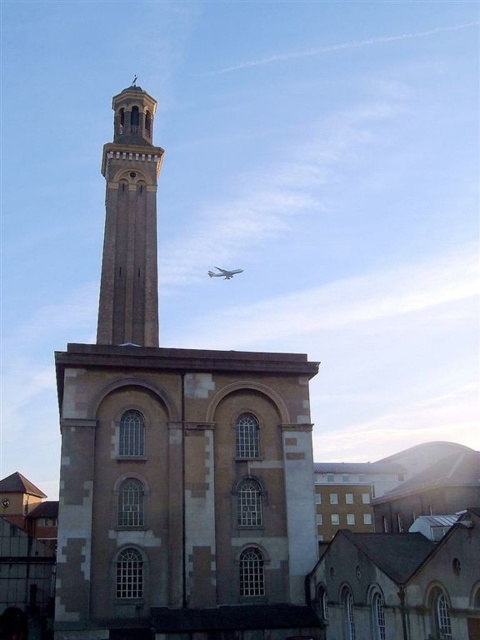
Consider the image. Which is below, brown stone tower at center or light brown stone tower at upper center?

brown stone tower at center is lower down.

Is point (195, 356) behind point (128, 312)?

No, (195, 356) is in front of (128, 312).

This screenshot has width=480, height=640. I want to click on brown stone tower at center, so click(175, 451).

Does light brown stone tower at upper center appear on the left side of white glossy airplane at upper center?

Yes, light brown stone tower at upper center is to the left of white glossy airplane at upper center.

Is point (147, 301) positioned after point (210, 272)?

That is False.

Identify the location of light brown stone tower at upper center. (130, 225).

Who is more distant from viewer, (x=132, y=524) or (x=235, y=272)?

The point (x=235, y=272) is more distant.

What do you see at coordinates (175, 451) in the screenshot?
I see `brown stone tower at center` at bounding box center [175, 451].

What do you see at coordinates (175, 451) in the screenshot? I see `brown stone tower at center` at bounding box center [175, 451].

The height and width of the screenshot is (640, 480). Find the location of `brown stone tower at center`. brown stone tower at center is located at coordinates (175, 451).